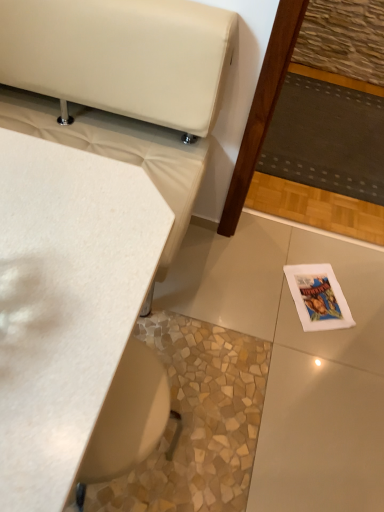
Where is `empty space that is ontop of white paper magazine at lower right`? The height and width of the screenshot is (512, 384). empty space that is ontop of white paper magazine at lower right is located at coordinates (322, 292).